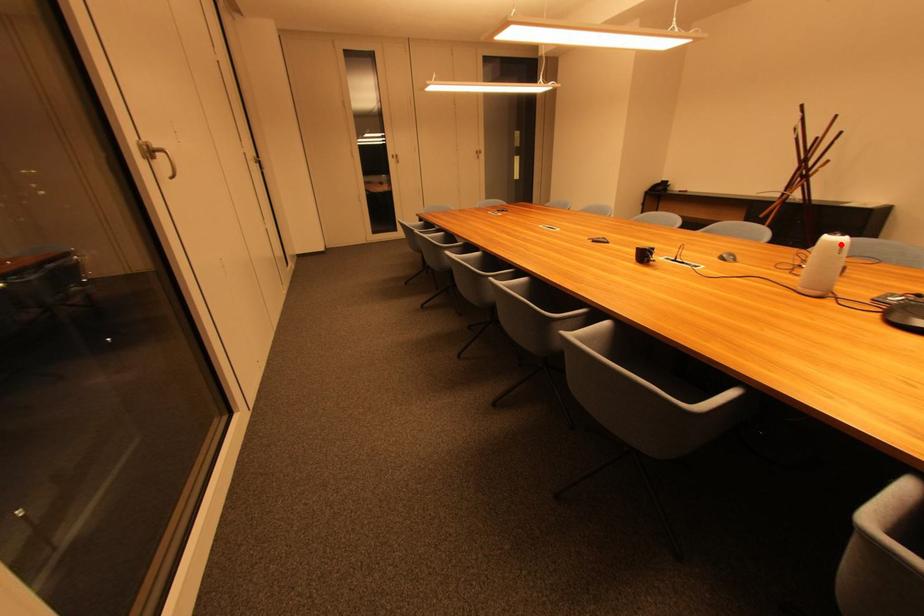
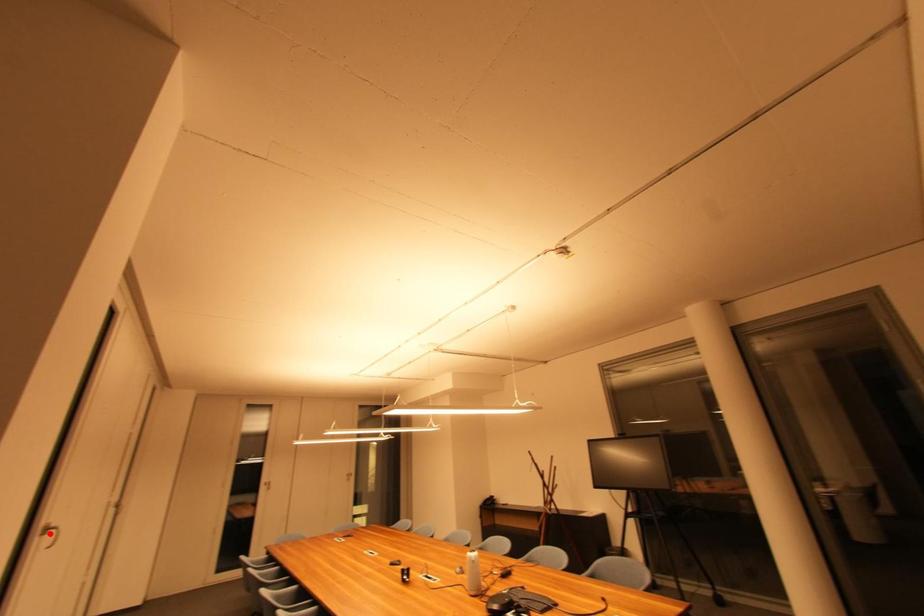
I am providing you with two images of the same scene from different viewpoints. A red point is marked on the first image and another point is marked on the second image. Does the point marked in image1 correspond to the same location as the one in image2?

No